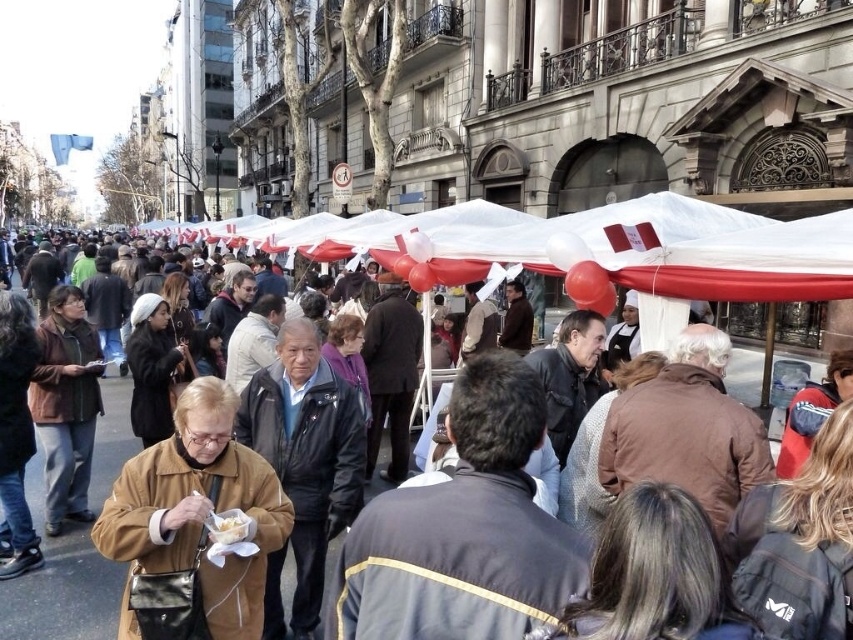
You are at a street fair and see a white paper bag at center and a white paper food at center. Which object is located below the other?

The white paper bag at center is positioned under the white paper food at center, so the white paper bag is below the white paper food.